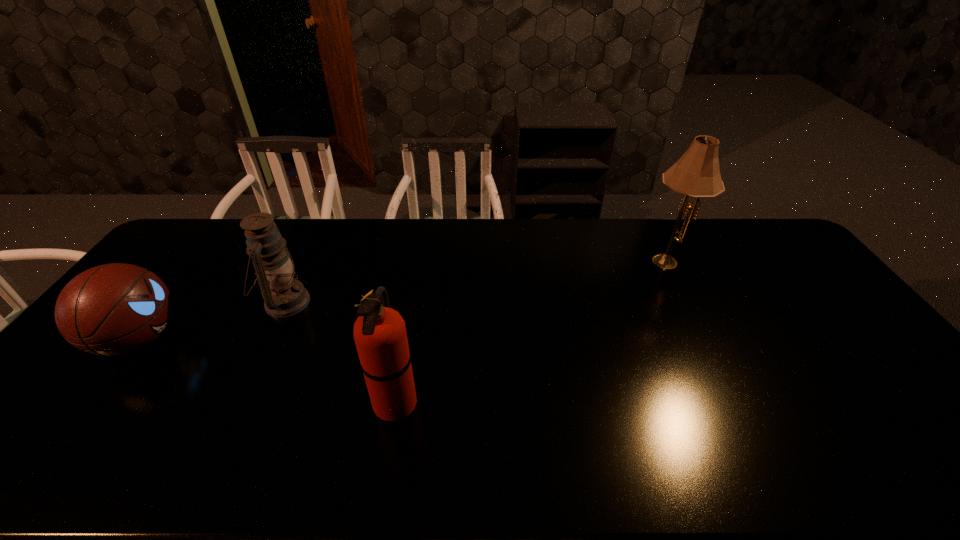
Find the location of `object that stands as the closest to the oil lamp`. object that stands as the closest to the oil lamp is located at coordinates (113, 309).

Find the location of a particular element. free space that satisfies the following two spatial constraints: 1. on the front side of the farthest object; 2. at the nozzle of the second tallest object is located at coordinates (739, 402).

Find the location of `free space that satisfies the following two spatial constraints: 1. on the back side of the basketball; 2. on the right side of the oil lamp`. free space that satisfies the following two spatial constraints: 1. on the back side of the basketball; 2. on the right side of the oil lamp is located at coordinates pyautogui.click(x=167, y=302).